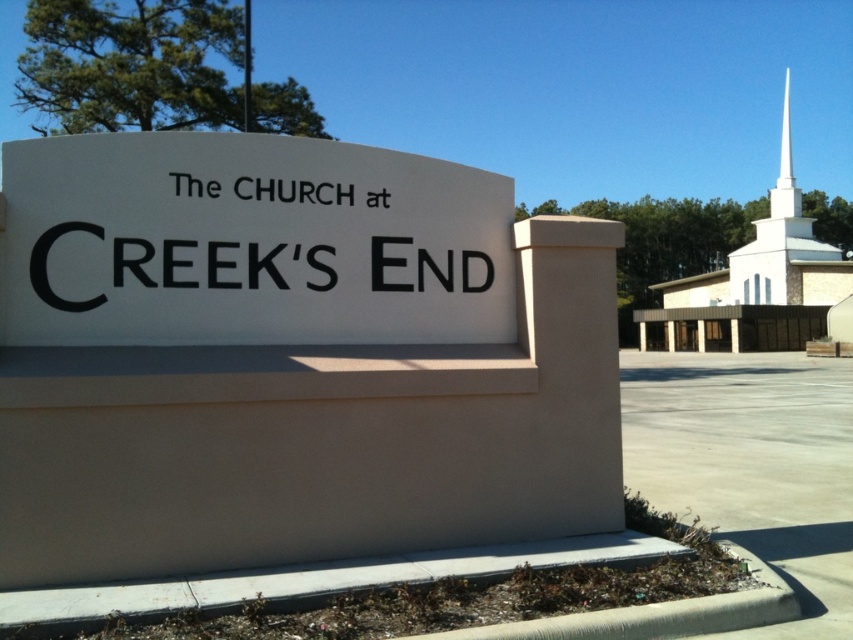
Question: Estimate the real-world distances between objects in this image. Which object is closer to the white smooth spire at upper right?

Choices:
 (A) white matte sign at center
 (B) white smooth steeple at upper right

Answer: (B)

Question: Can you confirm if white matte sign at center is wider than white smooth spire at upper right?

Choices:
 (A) yes
 (B) no

Answer: (B)

Question: Is white matte sign at center closer to camera compared to white smooth spire at upper right?

Choices:
 (A) no
 (B) yes

Answer: (B)

Question: Among these points, which one is nearest to the camera?

Choices:
 (A) (811, 221)
 (B) (784, 84)

Answer: (A)

Question: Does white smooth steeple at upper right appear on the right side of white smooth spire at upper right?

Choices:
 (A) yes
 (B) no

Answer: (B)

Question: Which of the following is the closest to the observer?

Choices:
 (A) white smooth steeple at upper right
 (B) white matte sign at center

Answer: (B)